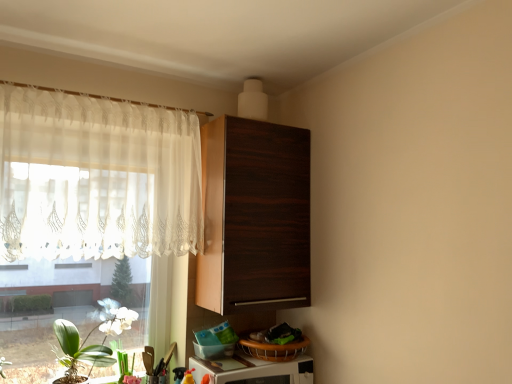
Question: Does green leafy plant at lower left touch white glossy microwave at lower center?

Choices:
 (A) yes
 (B) no

Answer: (B)

Question: From the image's perspective, is green leafy plant at lower left beneath white glossy microwave at lower center?

Choices:
 (A) no
 (B) yes

Answer: (A)

Question: From a real-world perspective, is green leafy plant at lower left located beneath white glossy microwave at lower center?

Choices:
 (A) yes
 (B) no

Answer: (B)

Question: Is the depth of green leafy plant at lower left greater than that of white glossy microwave at lower center?

Choices:
 (A) yes
 (B) no

Answer: (B)

Question: Is green leafy plant at lower left taller than white glossy microwave at lower center?

Choices:
 (A) no
 (B) yes

Answer: (B)

Question: Would you say green matte plant at lower left is to the left or to the right of sheer white curtain at left in the picture?

Choices:
 (A) left
 (B) right

Answer: (B)

Question: Considering their positions, is green matte plant at lower left located in front of or behind sheer white curtain at left?

Choices:
 (A) behind
 (B) front

Answer: (A)

Question: Considering the positions of green matte plant at lower left and sheer white curtain at left in the image, is green matte plant at lower left taller or shorter than sheer white curtain at left?

Choices:
 (A) tall
 (B) short

Answer: (B)

Question: Looking at the image, does green matte plant at lower left seem bigger or smaller compared to sheer white curtain at left?

Choices:
 (A) big
 (B) small

Answer: (B)

Question: From the image's perspective, relative to green matte plant at lower left, is dark wood cabinet at upper center above or below?

Choices:
 (A) below
 (B) above

Answer: (B)

Question: In terms of width, does dark wood cabinet at upper center look wider or thinner when compared to green matte plant at lower left?

Choices:
 (A) wide
 (B) thin

Answer: (A)

Question: Considering their positions, is dark wood cabinet at upper center located in front of or behind green matte plant at lower left?

Choices:
 (A) behind
 (B) front

Answer: (B)

Question: From their relative heights in the image, would you say dark wood cabinet at upper center is taller or shorter than green matte plant at lower left?

Choices:
 (A) short
 (B) tall

Answer: (B)

Question: Is point (70, 357) positioned closer to the camera than point (229, 364)?

Choices:
 (A) farther
 (B) closer

Answer: (A)

Question: Is green leafy plant at lower left wider or thinner than white glossy microwave at lower center?

Choices:
 (A) wide
 (B) thin

Answer: (B)